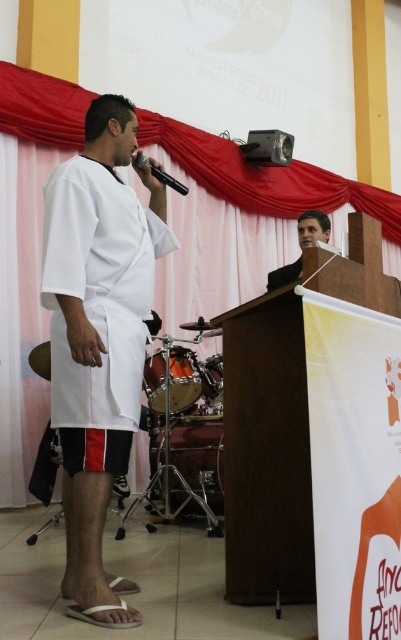
Question: Which object is closer to the camera taking this photo?

Choices:
 (A) pink fabric curtain at upper center
 (B) matte black shirt at center
 (C) shiny metallic drum at lower center
 (D) white matte shirt at center

Answer: (D)

Question: Estimate the real-world distances between objects in this image. Which object is farther from the matte black shirt at center?

Choices:
 (A) shiny metallic drum at lower center
 (B) white matte shirt at center
 (C) black matte microphone at upper center
 (D) pink fabric curtain at upper center

Answer: (D)

Question: Does matte black shirt at center have a lesser width compared to black matte microphone at upper center?

Choices:
 (A) yes
 (B) no

Answer: (B)

Question: Which object is farther from the camera taking this photo?

Choices:
 (A) black matte microphone at upper center
 (B) shiny metallic drum at lower center
 (C) matte black shirt at center
 (D) pink fabric curtain at upper center

Answer: (D)

Question: Can you confirm if white matte shirt at center is wider than matte black shirt at center?

Choices:
 (A) yes
 (B) no

Answer: (A)

Question: Does matte black shirt at center appear over black matte microphone at upper center?

Choices:
 (A) no
 (B) yes

Answer: (A)